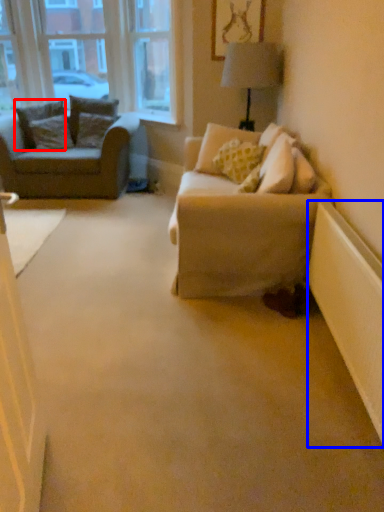
Question: Among these objects, which one is farthest to the camera, pillow (highlighted by a red box) or radiator (highlighted by a blue box)?

Choices:
 (A) pillow
 (B) radiator

Answer: (A)